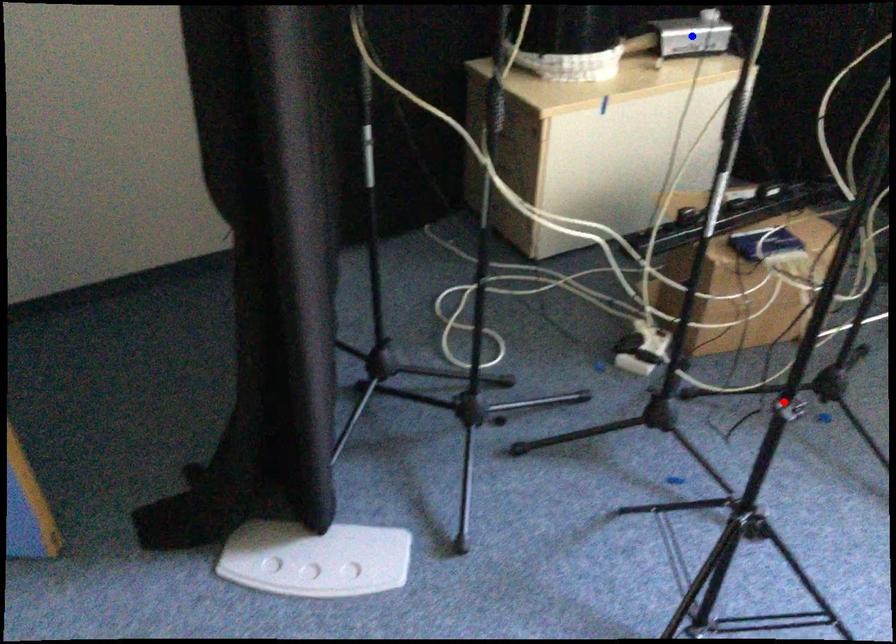
Question: Two points are marked on the image. Which point is closer to the camera?

Choices:
 (A) Blue point is closer.
 (B) Red point is closer.

Answer: (B)